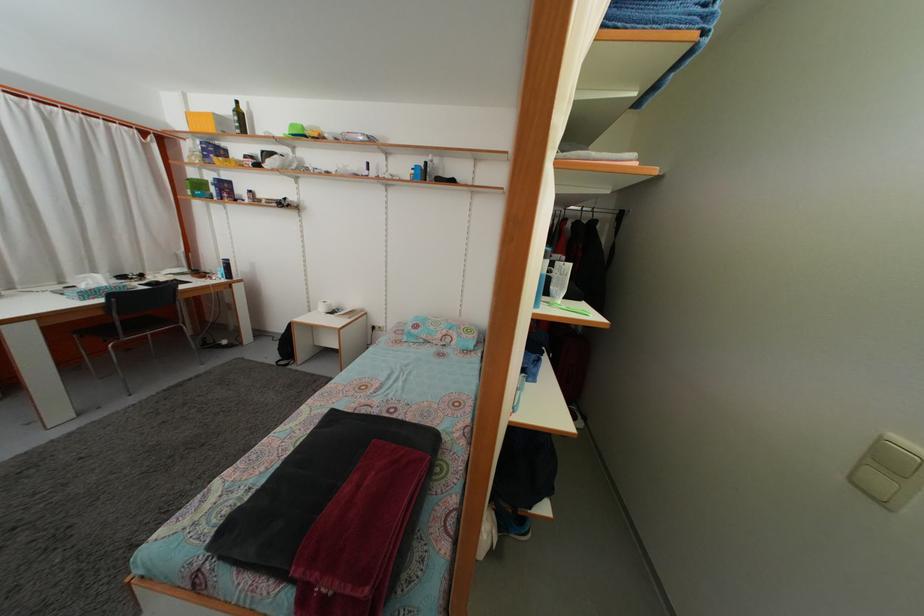
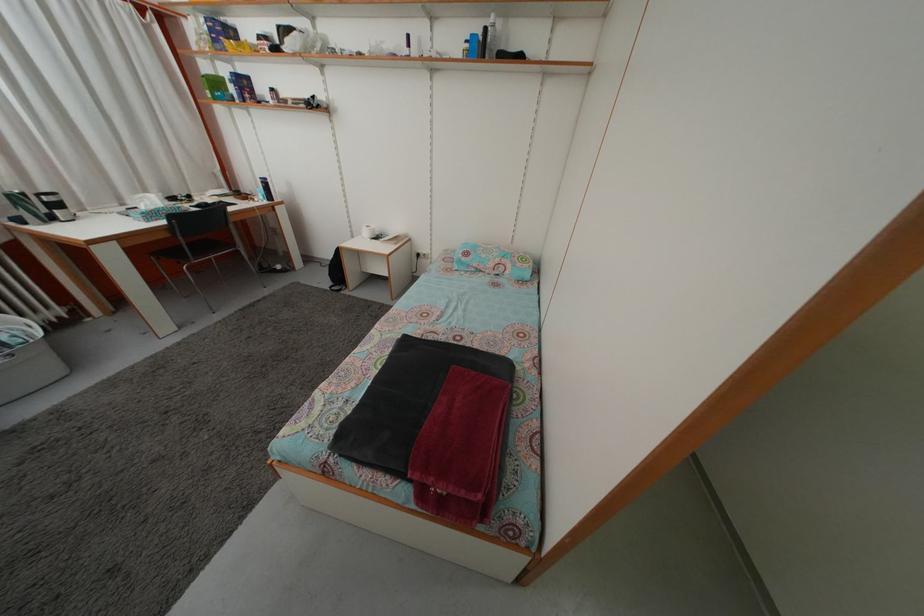
Find the pixel in the second image that matches (x=226, y=278) in the first image.

(266, 199)